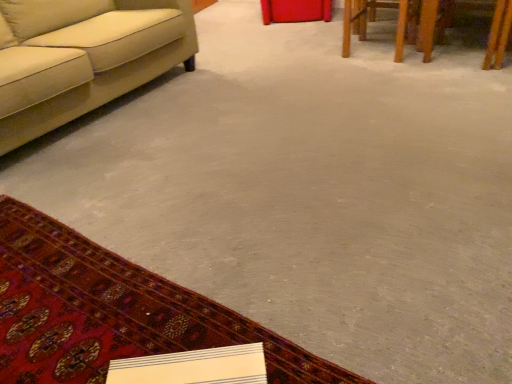
Question: Is wooden table at upper right oriented towards carpeted mat at lower left?

Choices:
 (A) yes
 (B) no

Answer: (B)

Question: Is wooden table at upper right far from carpeted mat at lower left?

Choices:
 (A) no
 (B) yes

Answer: (B)

Question: From the image's perspective, is wooden table at upper right above carpeted mat at lower left?

Choices:
 (A) no
 (B) yes

Answer: (B)

Question: From the image's perspective, does wooden table at upper right appear lower than carpeted mat at lower left?

Choices:
 (A) no
 (B) yes

Answer: (A)

Question: Is wooden table at upper right in front of carpeted mat at lower left?

Choices:
 (A) no
 (B) yes

Answer: (A)

Question: From a real-world perspective, is wooden table at upper right physically located above or below carpeted mat at lower left?

Choices:
 (A) below
 (B) above

Answer: (B)

Question: Do you think wooden table at upper right is within carpeted mat at lower left, or outside of it?

Choices:
 (A) inside
 (B) outside

Answer: (B)

Question: Is wooden table at upper right bigger or smaller than carpeted mat at lower left?

Choices:
 (A) big
 (B) small

Answer: (A)

Question: Is wooden table at upper right in front of or behind carpeted mat at lower left in the image?

Choices:
 (A) behind
 (B) front

Answer: (A)

Question: Looking at the image, does beige fabric couch at left seem bigger or smaller compared to wooden table at upper right?

Choices:
 (A) big
 (B) small

Answer: (A)

Question: From the image's perspective, is beige fabric couch at left above or below wooden table at upper right?

Choices:
 (A) above
 (B) below

Answer: (B)

Question: Visually, is beige fabric couch at left positioned to the left or to the right of wooden table at upper right?

Choices:
 (A) right
 (B) left

Answer: (B)

Question: Is beige fabric couch at left situated inside wooden table at upper right or outside?

Choices:
 (A) outside
 (B) inside

Answer: (A)

Question: In terms of width, does carpeted mat at lower left look wider or thinner when compared to wooden table at upper right?

Choices:
 (A) thin
 (B) wide

Answer: (B)

Question: Based on their sizes in the image, would you say carpeted mat at lower left is bigger or smaller than wooden table at upper right?

Choices:
 (A) big
 (B) small

Answer: (B)